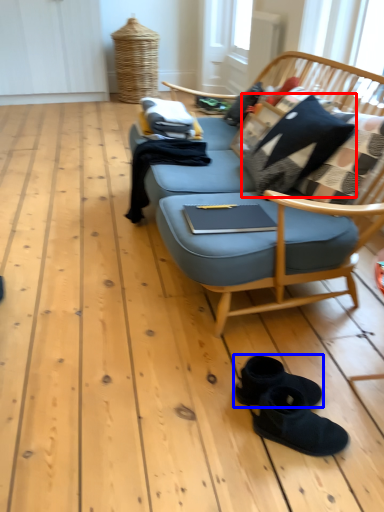
Question: Which object is further to the camera taking this photo, pillow (highlighted by a red box) or footwear (highlighted by a blue box)?

Choices:
 (A) pillow
 (B) footwear

Answer: (A)